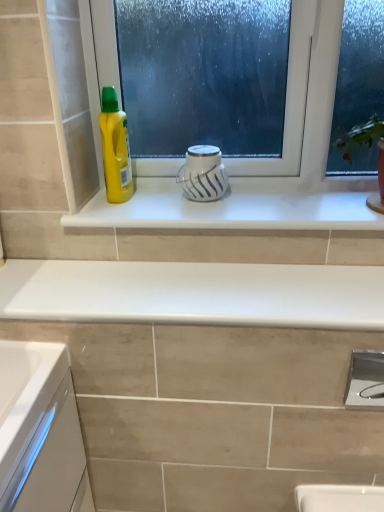
Question: Based on their sizes in the image, would you say white glossy mug at center is bigger or smaller than white glossy window sill at center?

Choices:
 (A) big
 (B) small

Answer: (B)

Question: Relative to white glossy window sill at center, is white glossy mug at center in front or behind?

Choices:
 (A) behind
 (B) front

Answer: (A)

Question: Which object is positioned closest to the satin nickel faucet at lower right?

Choices:
 (A) white glossy window sill at center
 (B) white glossy countertop at center
 (C) white glossy mug at center
 (D) yellow plastic bottle at left

Answer: (B)

Question: Which is farther from the satin nickel faucet at lower right?

Choices:
 (A) white glossy window sill at center
 (B) white glossy mug at center
 (C) yellow plastic bottle at left
 (D) white glossy countertop at center

Answer: (C)